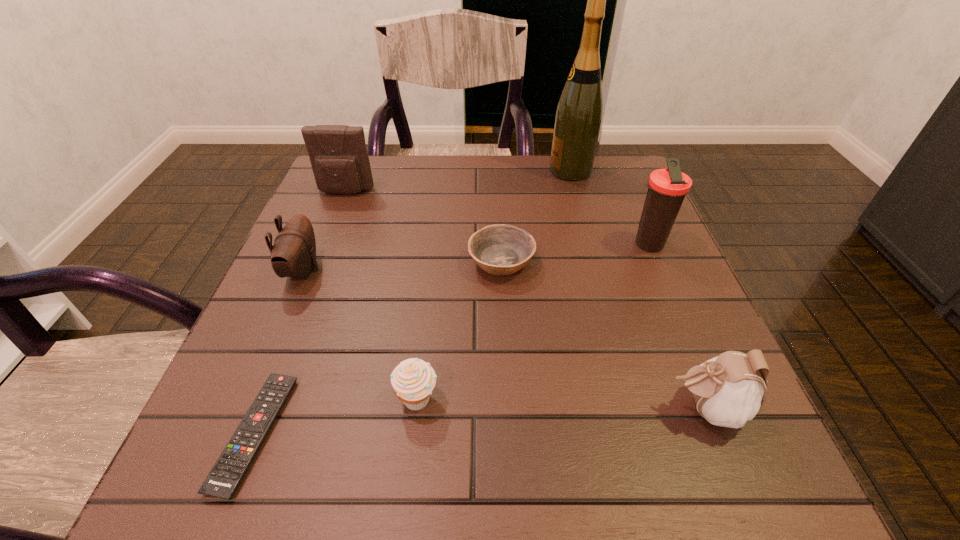
At what (x,y) coordinates should I click in order to perform the action: click on bowl. Please return your answer as a coordinate pair (x, y). Looking at the image, I should click on (503, 249).

This screenshot has width=960, height=540. Identify the location of remote control. pos(229,470).

I want to click on free region located 0.330m on the front-facing side of the wine bottle, so click(424, 171).

Where is `vacant region located on the front-facing side of the wine bottle`? The image size is (960, 540). vacant region located on the front-facing side of the wine bottle is located at coordinates (516, 171).

Locate an element on the screen. free region located 0.330m on the front-facing side of the wine bottle is located at coordinates (424, 171).

At what (x,y) coordinates should I click in order to perform the action: click on free space located 0.050m on the back of the second tallest object. Please return your answer as a coordinate pair (x, y). This screenshot has width=960, height=540. Looking at the image, I should click on (636, 219).

Locate an element on the screen. The height and width of the screenshot is (540, 960). free space located 0.270m with an open flap on the farthest pouch is located at coordinates (313, 275).

Where is `vacant space situated on the front-facing side of the nearest pouch`? The image size is (960, 540). vacant space situated on the front-facing side of the nearest pouch is located at coordinates (421, 408).

Identify the location of free space located on the front-facing side of the nearest pouch. The width and height of the screenshot is (960, 540). (454, 408).

Identify the location of vacant space positioned 0.110m on the front-facing side of the nearest pouch. The width and height of the screenshot is (960, 540). (593, 408).